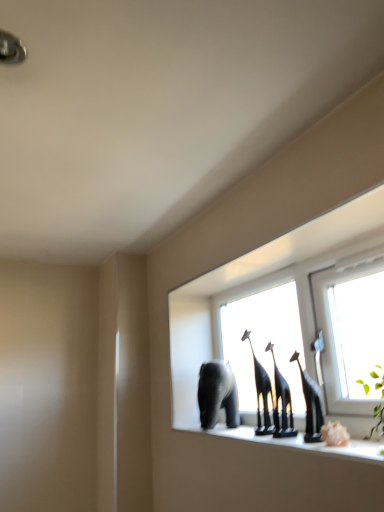
The width and height of the screenshot is (384, 512). Describe the element at coordinates (282, 402) in the screenshot. I see `black glossy giraffe at center` at that location.

Image resolution: width=384 pixels, height=512 pixels. Identify the location of transparent glass window at center. (288, 314).

Considering their positions, is gray matte elephant at center located in front of or behind transparent glass window at center?

gray matte elephant at center is positioned farther from the viewer than transparent glass window at center.

Is gray matte elephant at center spatially inside transparent glass window at center, or outside of it?

gray matte elephant at center cannot be found inside transparent glass window at center.

Considering the sizes of objects gray matte elephant at center and transparent glass window at center in the image provided, who is shorter, gray matte elephant at center or transparent glass window at center?

Standing shorter between the two is gray matte elephant at center.

From a real-world perspective, is gray matte elephant at center positioned over transparent glass window at center based on gravity?

No, from a real-world perspective, gray matte elephant at center is not over transparent glass window at center

From the image's perspective, which one is positioned lower, black glossy giraffe at center or gray matte elephant at center?

gray matte elephant at center appears lower in the image.

The image size is (384, 512). What are the coordinates of `elephant that is on the left side of black glossy giraffe at center` in the screenshot? It's located at (217, 394).

Is black glossy giraffe at center located outside gray matte elephant at center?

black glossy giraffe at center is positioned outside gray matte elephant at center.

Considering the positions of objects gray matte elephant at center and black glossy giraffe at center in the image provided, who is behind, gray matte elephant at center or black glossy giraffe at center?

gray matte elephant at center is further away from the camera.

Which is farther, [205,394] or [282,389]?

Point [205,394]

Can you confirm if gray matte elephant at center is bigger than black glossy giraffe at center?

Indeed, gray matte elephant at center has a larger size compared to black glossy giraffe at center.

Considering the sizes of gray matte elephant at center and black glossy giraffe at center in the image, is gray matte elephant at center taller or shorter than black glossy giraffe at center?

In the image, gray matte elephant at center appears to be shorter than black glossy giraffe at center.

Considering the sizes of objects transparent glass window at center and black glossy giraffe at center in the image provided, who is wider, transparent glass window at center or black glossy giraffe at center?

With larger width is transparent glass window at center.

Could you tell me if transparent glass window at center is turned towards black glossy giraffe at center?

Yes, transparent glass window at center is oriented towards black glossy giraffe at center.

From the image's perspective, is transparent glass window at center on black glossy giraffe at center?

Yes, from the image's perspective, transparent glass window at center is over black glossy giraffe at center.

Does transparent glass window at center lie in front of black glossy giraffe at center?

Yes, it is in front of black glossy giraffe at center.

Can you confirm if black glossy giraffe at center is positioned to the right of transparent glass window at center?

No, black glossy giraffe at center is not to the right of transparent glass window at center.

Who is more distant, black glossy giraffe at center or transparent glass window at center?

black glossy giraffe at center is behind.

Consider the image. Considering the sizes of objects black glossy giraffe at center and transparent glass window at center in the image provided, who is shorter, black glossy giraffe at center or transparent glass window at center?

With less height is black glossy giraffe at center.

Which object is closer to the camera, transparent glass window at center or gray matte elephant at center?

transparent glass window at center is closer to the camera.

From a real-world perspective, between transparent glass window at center and gray matte elephant at center, who is vertically higher?

From a 3D spatial view, transparent glass window at center is above.

Is transparent glass window at center smaller than gray matte elephant at center?

Actually, transparent glass window at center might be larger than gray matte elephant at center.

From the image's perspective, which one is positioned higher, transparent glass window at center or gray matte elephant at center?

From the image's view, transparent glass window at center is above.

Locate an element on the screen. This screenshot has height=512, width=384. elephant that appears below the transparent glass window at center (from a real-world perspective) is located at coordinates (217, 394).

This screenshot has height=512, width=384. I want to click on animal above the gray matte elephant at center (from the image's perspective), so click(282, 402).

Looking at this image, when comparing their distances from black glossy giraffe at center, does gray matte elephant at center or transparent glass window at center seem further?

transparent glass window at center is further to black glossy giraffe at center.

Based on their spatial positions, is gray matte elephant at center or black glossy giraffe at center further from transparent glass window at center?

black glossy giraffe at center is further to transparent glass window at center.

Which object lies nearer to the anchor point gray matte elephant at center, black glossy giraffe at center or transparent glass window at center?

black glossy giraffe at center.

Considering their positions, is black glossy giraffe at center positioned further to transparent glass window at center than gray matte elephant at center?

Among the two, black glossy giraffe at center is located further to transparent glass window at center.

From the image, which object appears to be nearer to black glossy giraffe at center, transparent glass window at center or gray matte elephant at center?

Among the two, gray matte elephant at center is located nearer to black glossy giraffe at center.

Looking at the image, which one is located further to gray matte elephant at center, transparent glass window at center or black glossy giraffe at center?

transparent glass window at center.

Where is `animal between transparent glass window at center and gray matte elephant at center along the z-axis`? animal between transparent glass window at center and gray matte elephant at center along the z-axis is located at coordinates (282, 402).